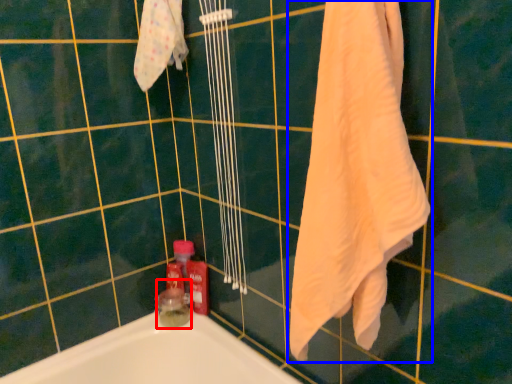
Question: Which object is closer to the camera taking this photo, toiletry (highlighted by a red box) or towel (highlighted by a blue box)?

Choices:
 (A) toiletry
 (B) towel

Answer: (B)